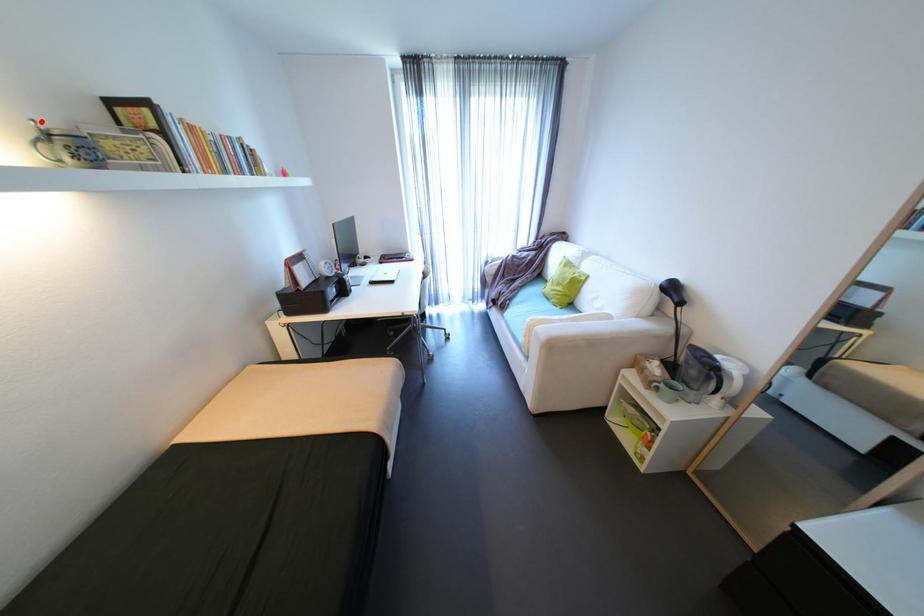
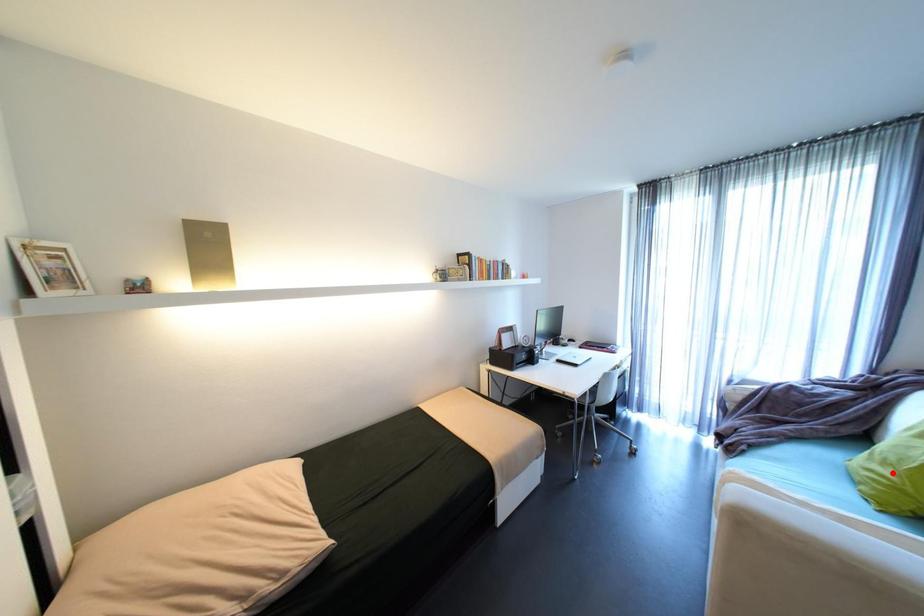
I am providing you with two images of the same scene from different viewpoints. A red point is marked on the first image and another point is marked on the second image. Is the marked point in image1 the same physical position as the marked point in image2?

No